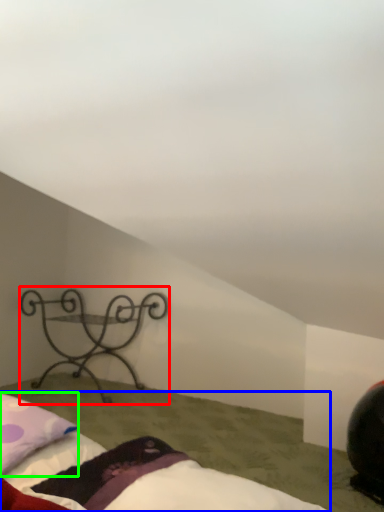
Question: Estimate the real-world distances between objects in this image. Which object is farther from furniture (highlighted by a red box), bed (highlighted by a blue box) or pillow (highlighted by a green box)?

Choices:
 (A) bed
 (B) pillow

Answer: (A)